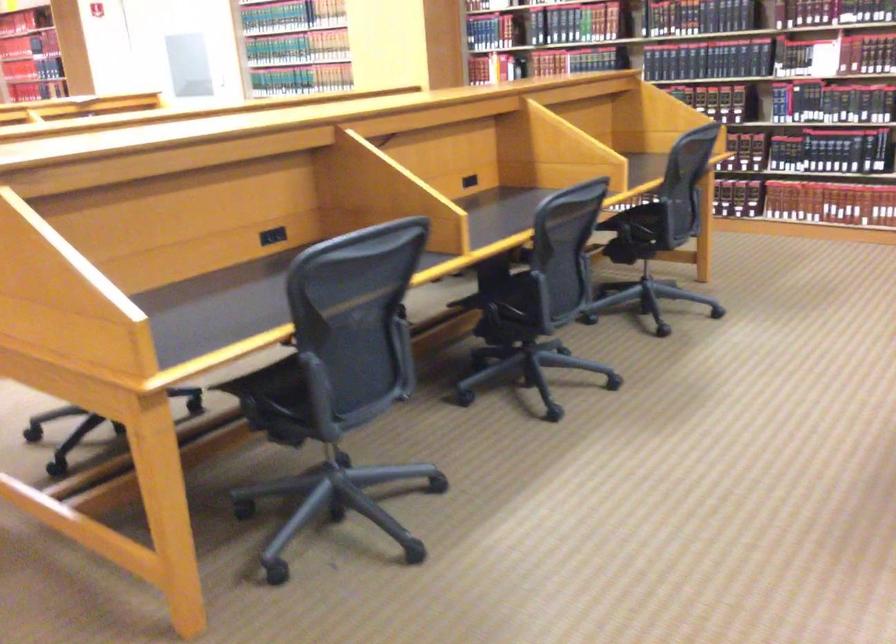
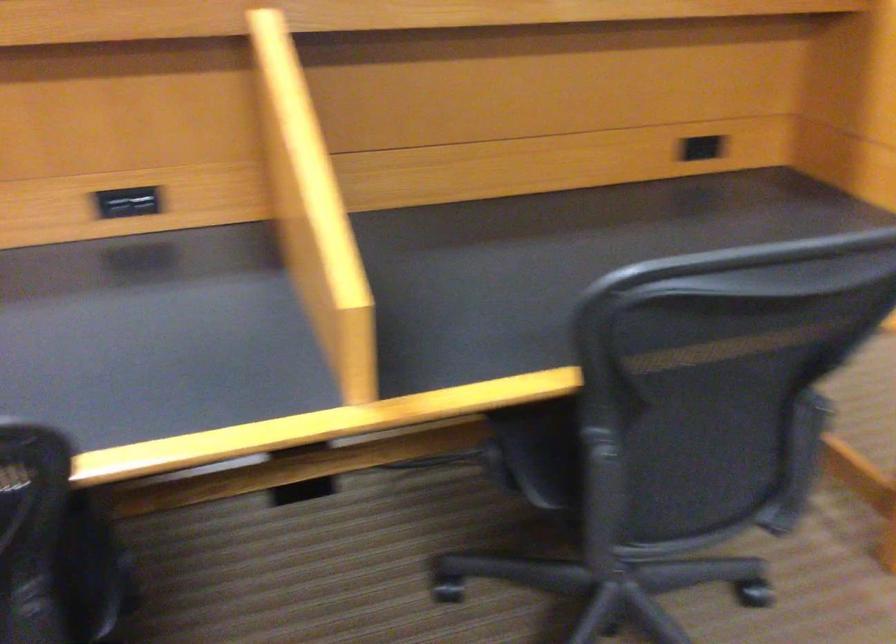
Find the pixel in the second image that matches (x=588, y=131) in the first image.

(702, 147)